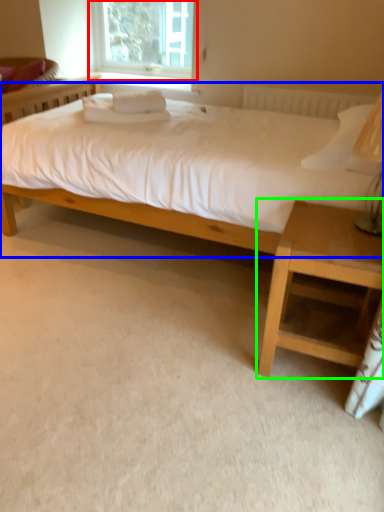
Question: Considering the real-world distances, which object is closest to window (highlighted by a red box)? bed (highlighted by a blue box) or nightstand (highlighted by a green box).

Choices:
 (A) bed
 (B) nightstand

Answer: (A)